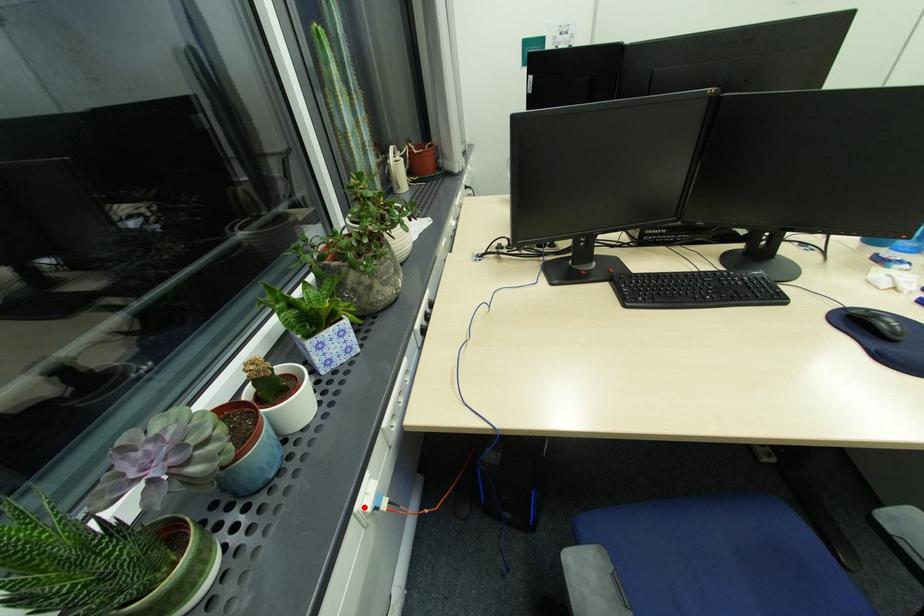
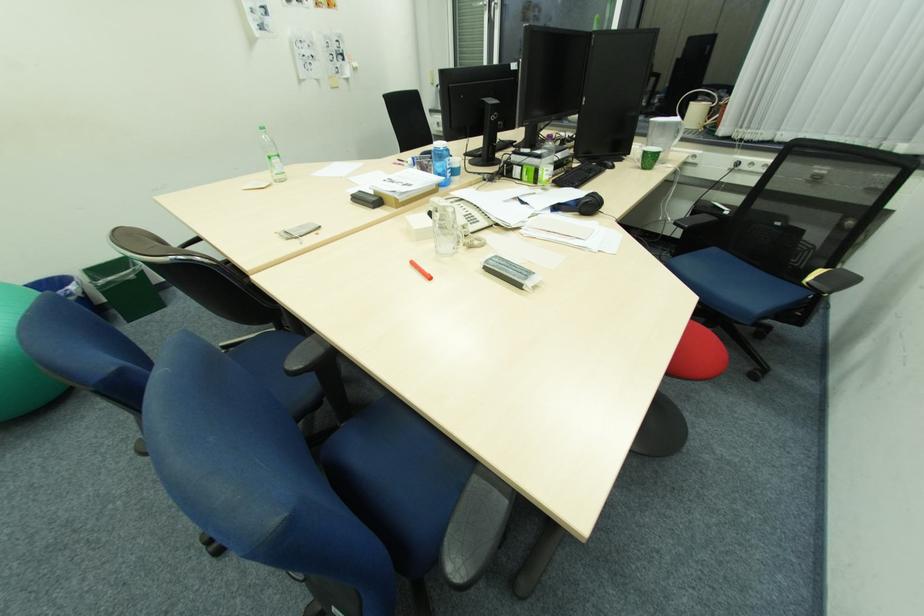
Question: I am providing you with two images of the same scene from different viewpoints. A red point is marked on the first image. Can you still see the location of the red point in image 2?

Choices:
 (A) Yes
 (B) No

Answer: (B)